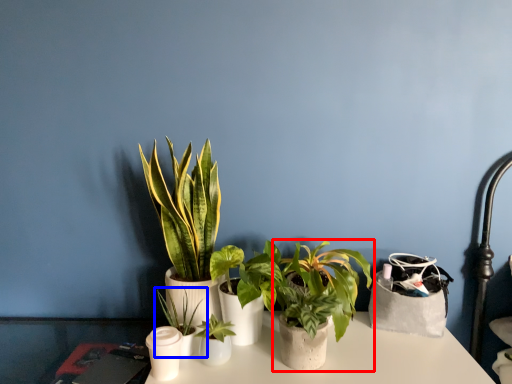
Question: Which object is closer to the camera taking this photo, houseplant (highlighted by a red box) or houseplant (highlighted by a blue box)?

Choices:
 (A) houseplant
 (B) houseplant

Answer: (B)